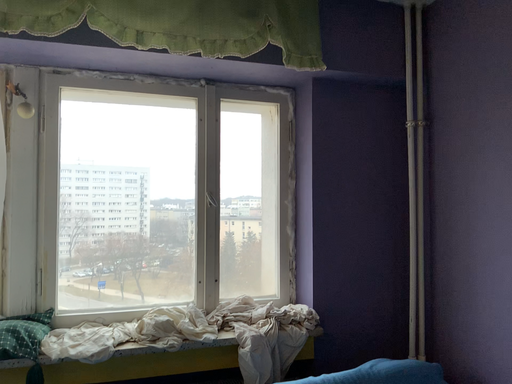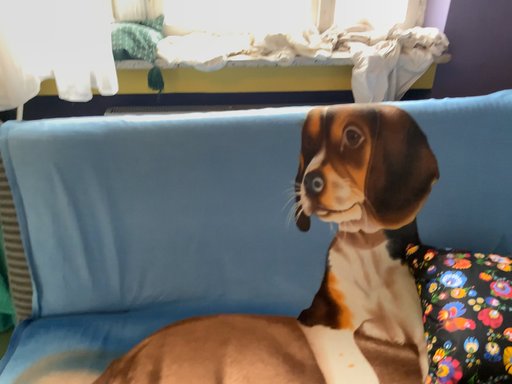
Question: How did the camera likely rotate when shooting the video?

Choices:
 (A) rotated downward
 (B) rotated upward

Answer: (A)